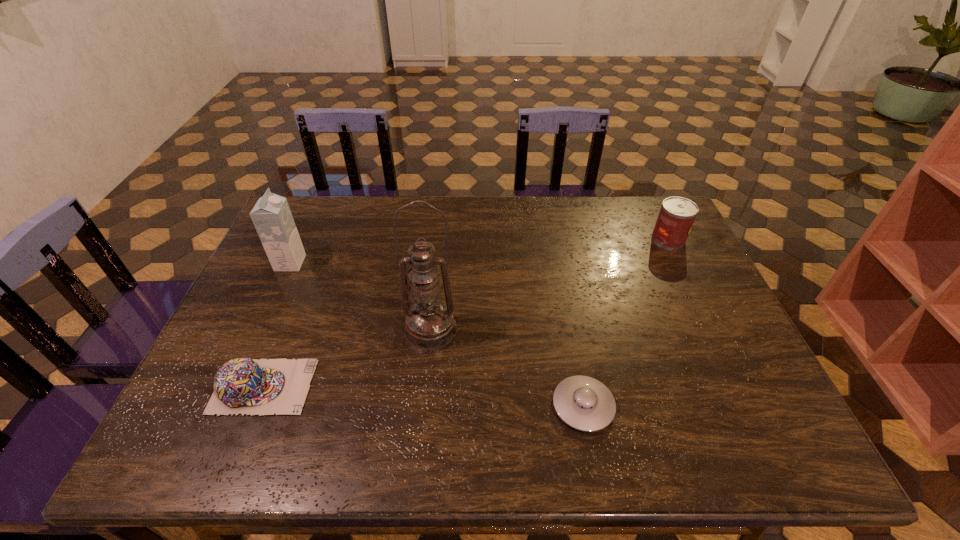
The height and width of the screenshot is (540, 960). I want to click on vacant space located 0.180m on the front label of the fourth nearest object, so click(362, 263).

The width and height of the screenshot is (960, 540). Identify the location of free spot located 0.050m on the left of the can. (636, 239).

Locate an element on the screen. The image size is (960, 540). vacant area situated 0.170m on the front, side, and top of the cap is located at coordinates (384, 387).

You are a GUI agent. You are given a task and a screenshot of the screen. Output one action in this format:
    pyautogui.click(x=<x>, y=<y>)
    Task: Click on the free space located 0.350m on the right of the shortest object
    The height and width of the screenshot is (540, 960).
    Given the screenshot: What is the action you would take?
    click(769, 406)

At what (x,y) coordinates should I click in order to perform the action: click on object that is at the far edge. Please return your answer as a coordinate pair (x, y). The width and height of the screenshot is (960, 540). Looking at the image, I should click on (676, 217).

Identify the location of object present at the near edge. This screenshot has width=960, height=540. (584, 403).

Image resolution: width=960 pixels, height=540 pixels. Find the location of `carton at the left edge`. carton at the left edge is located at coordinates (271, 215).

Where is `cap that is at the left edge`? The height and width of the screenshot is (540, 960). cap that is at the left edge is located at coordinates (248, 386).

Locate an element on the screen. object present at the right edge is located at coordinates (676, 217).

Where is `object that is at the far right corner`? This screenshot has width=960, height=540. object that is at the far right corner is located at coordinates (676, 217).